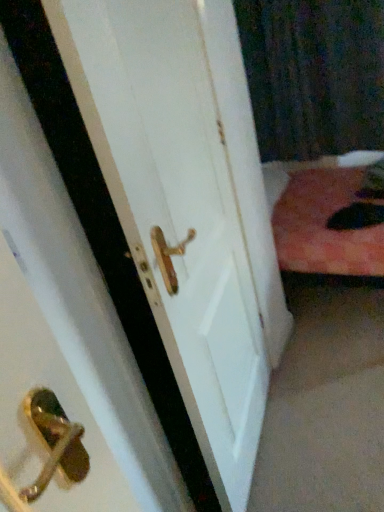
Locate an element on the screen. This screenshot has width=384, height=512. fluffy black cat at lower right is located at coordinates coord(360,211).

The width and height of the screenshot is (384, 512). Describe the element at coordinates (314, 75) in the screenshot. I see `black textured curtain at upper right` at that location.

Image resolution: width=384 pixels, height=512 pixels. Identify the location of fluffy black cat at lower right. (360, 211).

Between black textured curtain at upper right and white matte door handle at center, which one is positioned in front?

white matte door handle at center is in front.

Is black textured curtain at upper right bigger than white matte door handle at center?

Indeed, black textured curtain at upper right has a larger size compared to white matte door handle at center.

Identify the location of door that appears below the black textured curtain at upper right (from the image's perspective). (187, 203).

Considering the relative sizes of black textured curtain at upper right and white matte door handle at center in the image provided, is black textured curtain at upper right wider than white matte door handle at center?

Indeed, black textured curtain at upper right has a greater width compared to white matte door handle at center.

In the scene shown: How distant is black textured curtain at upper right from fluffy black cat at lower right?

28.59 inches.

Is black textured curtain at upper right completely or partially outside of fluffy black cat at lower right?

Absolutely, black textured curtain at upper right is external to fluffy black cat at lower right.

Which is more to the left, black textured curtain at upper right or fluffy black cat at lower right?

From the viewer's perspective, black textured curtain at upper right appears more on the left side.

Can you confirm if black textured curtain at upper right is wider than fluffy black cat at lower right?

No, black textured curtain at upper right is not wider than fluffy black cat at lower right.

Based on the photo, from the image's perspective, does fluffy black cat at lower right appear higher than black textured curtain at upper right?

No, from the image's perspective, fluffy black cat at lower right is not above black textured curtain at upper right.

Does point (368, 209) come farther from viewer compared to point (256, 60)?

No.

Is the depth of fluffy black cat at lower right less than that of black textured curtain at upper right?

Yes, it is.

Is fluffy black cat at lower right thinner than black textured curtain at upper right?

In fact, fluffy black cat at lower right might be wider than black textured curtain at upper right.

Locate an element on the screen. door in front of the black textured curtain at upper right is located at coordinates (187, 203).

Which is nearer, [217,48] or [364,127]?

Point [217,48] is positioned closer to the camera compared to point [364,127].

Which object is thinner, white matte door handle at center or black textured curtain at upper right?

white matte door handle at center.

Is white matte door handle at center inside the boundaries of black textured curtain at upper right, or outside?

white matte door handle at center is not inside black textured curtain at upper right, it's outside.

Can you confirm if white matte door handle at center is bigger than fluffy black cat at lower right?

Yes, white matte door handle at center is bigger than fluffy black cat at lower right.

Can you confirm if white matte door handle at center is positioned to the left of fluffy black cat at lower right?

Result: Yes, white matte door handle at center is to the left of fluffy black cat at lower right.

Is white matte door handle at center directly adjacent to fluffy black cat at lower right?

No, white matte door handle at center is not making contact with fluffy black cat at lower right.

From the image's perspective, is white matte door handle at center above fluffy black cat at lower right?

No, from the image's perspective, white matte door handle at center is not on top of fluffy black cat at lower right.

Is fluffy black cat at lower right completely or partially outside of white matte door handle at center?

Yes.

Looking at this image, from a real-world perspective, relative to white matte door handle at center, is fluffy black cat at lower right vertically above or below?

In terms of real-world spatial position, fluffy black cat at lower right is below white matte door handle at center.

From the image's perspective, which one is positioned higher, fluffy black cat at lower right or white matte door handle at center?

fluffy black cat at lower right is shown above in the image.

Locate an element on the screen. door in front of the black textured curtain at upper right is located at coordinates (187, 203).

Identify the location of curtain behind the fluffy black cat at lower right. 314,75.

Based on their spatial positions, is black textured curtain at upper right or fluffy black cat at lower right further from white matte door handle at center?

Based on the image, black textured curtain at upper right appears to be further to white matte door handle at center.

Which object lies further to the anchor point black textured curtain at upper right, white matte door handle at center or fluffy black cat at lower right?

The object further to black textured curtain at upper right is white matte door handle at center.

Based on their spatial positions, is white matte door handle at center or black textured curtain at upper right further from fluffy black cat at lower right?

white matte door handle at center is positioned further to the anchor fluffy black cat at lower right.

From the image, which object appears to be nearer to black textured curtain at upper right, fluffy black cat at lower right or white matte door handle at center?

fluffy black cat at lower right lies closer to black textured curtain at upper right than the other object.

When comparing their distances from white matte door handle at center, does fluffy black cat at lower right or black textured curtain at upper right seem closer?

fluffy black cat at lower right.

When comparing their distances from fluffy black cat at lower right, does black textured curtain at upper right or white matte door handle at center seem further?

white matte door handle at center lies further to fluffy black cat at lower right than the other object.

Where is `cat positioned between white matte door handle at center and black textured curtain at upper right from near to far`? cat positioned between white matte door handle at center and black textured curtain at upper right from near to far is located at coordinates [360, 211].